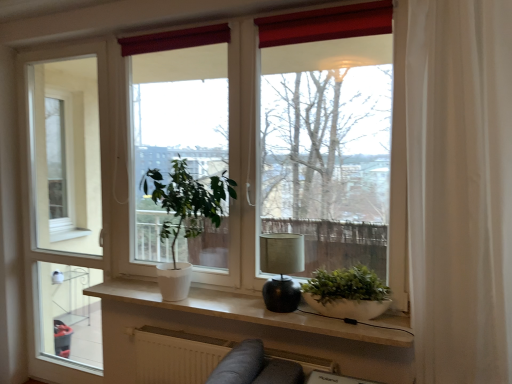
Image resolution: width=512 pixels, height=384 pixels. Describe the element at coordinates (460, 188) in the screenshot. I see `white sheer curtain at right` at that location.

Describe the element at coordinates (66, 204) in the screenshot. I see `white glossy screen door at left` at that location.

Identify the location of white matte radiator at lower center. Image resolution: width=512 pixels, height=384 pixels. (176, 355).

Does green matte plant at center, which appears as the 2th houseplant when viewed from the left, appear on the left side of white sheer curtain at right?

Correct, you'll find green matte plant at center, which appears as the 2th houseplant when viewed from the left, to the left of white sheer curtain at right.

Locate an element on the screen. Image resolution: width=512 pixels, height=384 pixels. curtain above the green matte plant at center, which appears as the first houseplant when viewed from the right (from the image's perspective) is located at coordinates (460, 188).

Which of these two, green matte plant at center, which appears as the 2th houseplant when viewed from the left, or white sheer curtain at right, stands shorter?

With less height is green matte plant at center, which appears as the 2th houseplant when viewed from the left.

Could you tell me if white matte window sill at center is turned towards white sheer curtain at right?

No, white matte window sill at center is not aimed at white sheer curtain at right.

Does white matte window sill at center have a lesser width compared to white sheer curtain at right?

Correct, the width of white matte window sill at center is less than that of white sheer curtain at right.

Is white matte window sill at center at the right side of white sheer curtain at right?

No.

Is white sheer curtain at right located within white matte window sill at center?

No, white matte window sill at center does not contain white sheer curtain at right.

From the image's perspective, is white matte window sill at center positioned above or below matte black lamp at center?

From the image's perspective, white matte window sill at center appears below matte black lamp at center.

Is matte black lamp at center at the back of white matte window sill at center?

No, white matte window sill at center is not facing away from matte black lamp at center.

Is white matte window sill at center shorter than matte black lamp at center?

Yes.

Can we say white matte window sill at center lies outside matte black lamp at center?

Yes, white matte window sill at center is outside of matte black lamp at center.

Is matte black lamp at center in front of or behind white matte window at center in the image?

In the image, matte black lamp at center appears behind white matte window at center.

Does matte black lamp at center have a larger size compared to white matte window at center?

Actually, matte black lamp at center might be smaller than white matte window at center.

From the image's perspective, is matte black lamp at center under white matte window at center?

Indeed, from the image's perspective, matte black lamp at center is shown beneath white matte window at center.

Is point (276, 304) positioned before point (397, 285)?

No, it is behind (397, 285).

Looking at the image, does green matte plant at center, which appears as the first houseplant when viewed from the right, seem bigger or smaller compared to white matte radiator at lower center?

Considering their sizes, green matte plant at center, which appears as the first houseplant when viewed from the right, takes up less space than white matte radiator at lower center.

Measure the distance from green matte plant at center, which appears as the first houseplant when viewed from the right, to white matte radiator at lower center.

green matte plant at center, which appears as the first houseplant when viewed from the right, and white matte radiator at lower center are 27.86 inches apart.

Is green matte plant at center, which appears as the 2th houseplant when viewed from the left, wider than white matte radiator at lower center?

No, green matte plant at center, which appears as the 2th houseplant when viewed from the left, is not wider than white matte radiator at lower center.

Is white matte radiator at lower center not near matte black lamp at center?

No, white matte radiator at lower center is in close proximity to matte black lamp at center.

From the image's perspective, is white matte radiator at lower center on top of matte black lamp at center?

No, from the image's perspective, white matte radiator at lower center is not above matte black lamp at center.

Do you think white matte radiator at lower center is within matte black lamp at center, or outside of it?

white matte radiator at lower center lies outside matte black lamp at center.

Does point (197, 341) appear closer or farther from the camera than point (289, 292)?

Point (197, 341) is farther from the camera than point (289, 292).

Does white sheer curtain at right touch white matte plant at center, which is the 2th houseplant in right-to-left order?

There is a gap between white sheer curtain at right and white matte plant at center, which is the 2th houseplant in right-to-left order.

Considering the relative positions of white sheer curtain at right and white matte plant at center, which is the 2th houseplant in right-to-left order, in the image provided, is white sheer curtain at right in front of white matte plant at center, which is the 2th houseplant in right-to-left order,?

That is True.

Can you confirm if white sheer curtain at right is shorter than white matte plant at center, which is the 2th houseplant in right-to-left order?

No, white sheer curtain at right is not shorter than white matte plant at center, which is the 2th houseplant in right-to-left order.

Is white sheer curtain at right looking in the opposite direction of white matte plant at center, which is the 1th houseplant from left to right?

No.

The width and height of the screenshot is (512, 384). What are the coordinates of `curtain lying on the right of green matte plant at center, which appears as the 2th houseplant when viewed from the left` in the screenshot? It's located at (460, 188).

The image size is (512, 384). I want to click on window sill below the white sheer curtain at right (from a real-world perspective), so click(x=256, y=311).

Considering their positions, is white glossy screen door at left positioned closer to green matte plant at center, which appears as the first houseplant when viewed from the right, than white matte window at center?

white matte window at center.

Looking at the image, which one is located further to white matte window sill at center, matte black lamp at center or white matte plant at center, which is the 1th houseplant from left to right?

The object further to white matte window sill at center is white matte plant at center, which is the 1th houseplant from left to right.

Based on their spatial positions, is white matte window sill at center or white sheer curtain at right further from white matte plant at center, which is the 2th houseplant in right-to-left order?

Among the two, white sheer curtain at right is located further to white matte plant at center, which is the 2th houseplant in right-to-left order.

When comparing their distances from white matte window sill at center, does white matte plant at center, which is the 2th houseplant in right-to-left order, or white matte window at center seem closer?

white matte plant at center, which is the 2th houseplant in right-to-left order.

Which object lies nearer to the anchor point green matte plant at center, which appears as the first houseplant when viewed from the right, white matte radiator at lower center or white sheer curtain at right?

Based on the image, white sheer curtain at right appears to be nearer to green matte plant at center, which appears as the first houseplant when viewed from the right.

Looking at the image, which one is located closer to white matte plant at center, which is the 2th houseplant in right-to-left order, white sheer curtain at right or white glossy screen door at left?

Based on the image, white glossy screen door at left appears to be nearer to white matte plant at center, which is the 2th houseplant in right-to-left order.

Based on their spatial positions, is white matte radiator at lower center or white matte window sill at center closer to white glossy screen door at left?

white matte window sill at center is positioned closer to the anchor white glossy screen door at left.

Considering their positions, is matte black lamp at center positioned closer to white sheer curtain at right than white matte plant at center, which is the 2th houseplant in right-to-left order?

Based on the image, matte black lamp at center appears to be nearer to white sheer curtain at right.

Locate an element on the screen. houseplant between white glossy screen door at left and green matte plant at center, which appears as the first houseplant when viewed from the right, in the horizontal direction is located at coordinates (185, 217).

Identify the location of houseplant located between white matte window at center and white sheer curtain at right in the left-right direction. (347, 293).

Find the location of a particular element. This screenshot has height=384, width=512. window sill between white matte radiator at lower center and matte black lamp at center along the z-axis is located at coordinates (256, 311).

Identify the location of lamp between white glossy screen door at left and white sheer curtain at right from left to right. (281, 270).